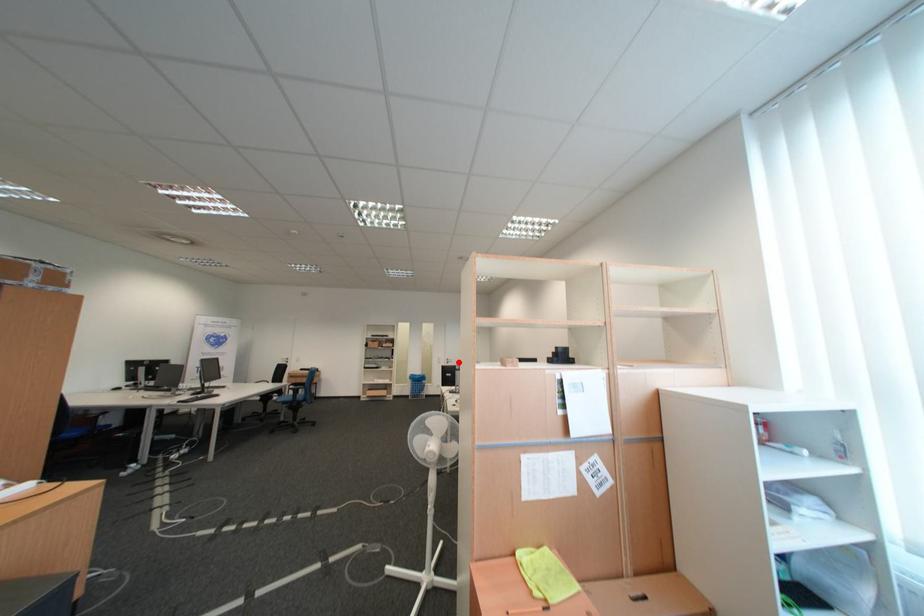
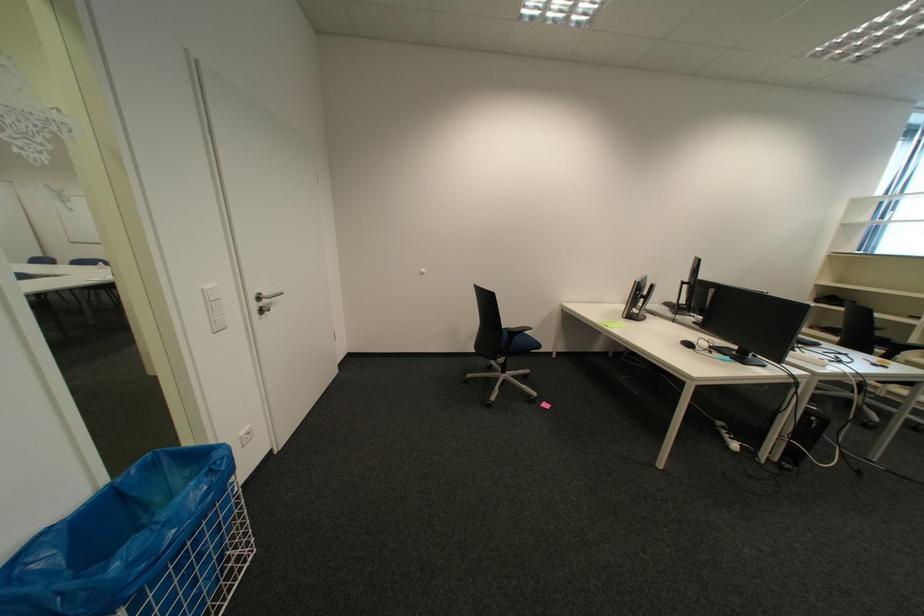
In the second image, find the point that corresponds to the highlighted location in the first image.

(266, 307)